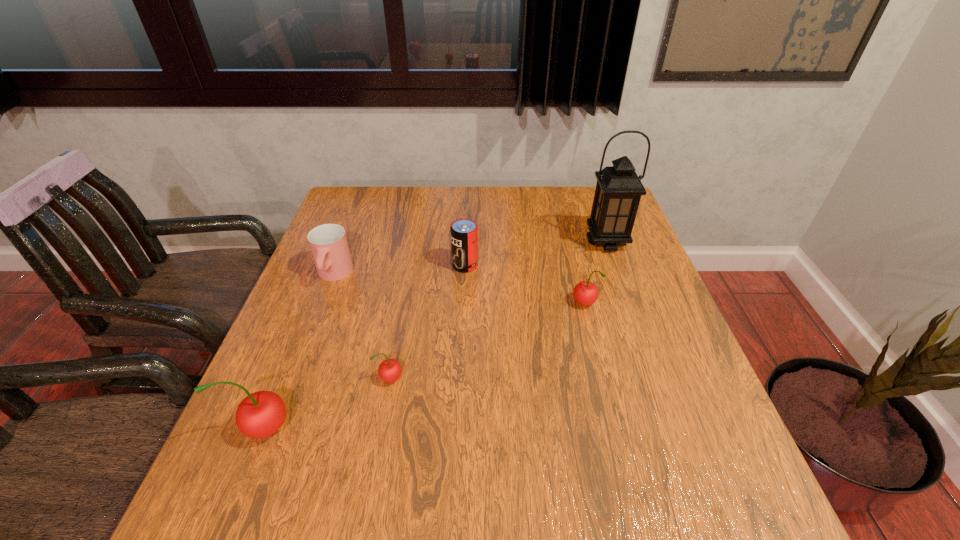
You are a GUI agent. You are given a task and a screenshot of the screen. Output one action in this format:
    pyautogui.click(x=<x>, y=<y>)
    Task: Click on the nearest object
    This screenshot has height=540, width=960.
    Given the screenshot: What is the action you would take?
    pyautogui.click(x=261, y=414)

Image resolution: width=960 pixels, height=540 pixels. In order to click on the second tallest object in this screenshot , I will do `click(261, 414)`.

This screenshot has width=960, height=540. Identify the location of the second cherry from left to right. (389, 370).

Image resolution: width=960 pixels, height=540 pixels. Find the location of `the shortest object`. the shortest object is located at coordinates (389, 370).

Where is `the second shortest cherry`? the second shortest cherry is located at coordinates (585, 293).

Where is `the rightmost cherry`? This screenshot has width=960, height=540. the rightmost cherry is located at coordinates (585, 293).

Where is `the tallest object`? the tallest object is located at coordinates (618, 191).

The height and width of the screenshot is (540, 960). I want to click on lantern, so click(x=618, y=191).

Identify the location of cup. The height and width of the screenshot is (540, 960). (328, 242).

This screenshot has width=960, height=540. I want to click on can, so click(x=464, y=232).